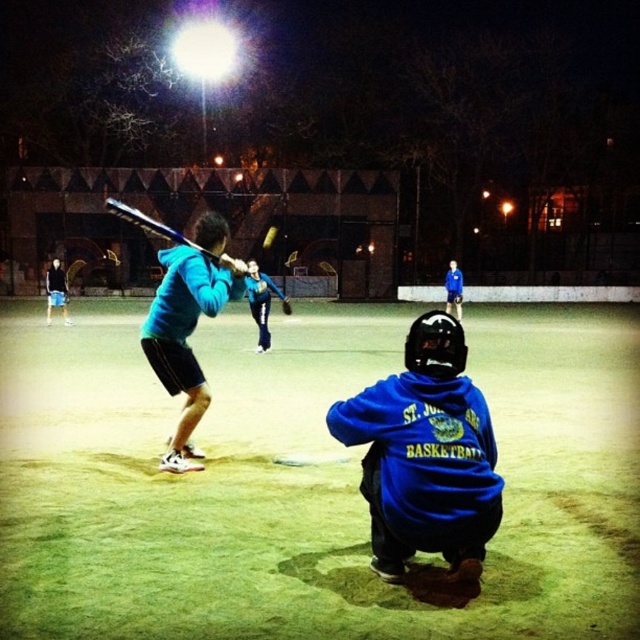
Can you confirm if matte blue baseball bat at center is bigger than shiny blue bat at center?

Incorrect, matte blue baseball bat at center is not larger than shiny blue bat at center.

Is matte blue baseball bat at center behind shiny blue bat at center?

No, matte blue baseball bat at center is closer to the viewer.

Is point (161, 372) farther from camera compared to point (134, 212)?

Yes, point (161, 372) is farther from viewer.

You are a GUI agent. You are given a task and a screenshot of the screen. Output one action in this format:
    pyautogui.click(x=<x>, y=<y>)
    Task: Click on the matte blue baseball bat at center
    The height and width of the screenshot is (640, 640).
    Given the screenshot: What is the action you would take?
    pyautogui.click(x=188, y=326)

Between point (410, 513) and point (132, 221), which one is positioned in front?

Positioned in front is point (410, 513).

Who is more forward, (x=477, y=394) or (x=148, y=227)?

Point (x=477, y=394)

Locate an element on the screen. Image resolution: width=640 pixels, height=640 pixels. blue fleece jacket at lower center is located at coordinates (426, 454).

Consider the image. Can you confirm if matte blue baseball bat at center is thinner than dark blue hoodie at left?

Indeed, matte blue baseball bat at center has a lesser width compared to dark blue hoodie at left.

I want to click on matte blue baseball bat at center, so click(188, 326).

Identify the location of matte blue baseball bat at center. Image resolution: width=640 pixels, height=640 pixels. (188, 326).